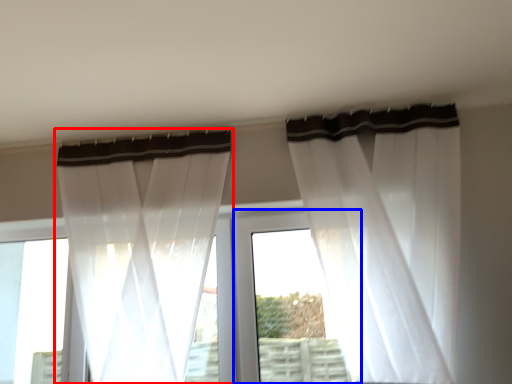
Question: Among these objects, which one is nearest to the camera, curtain (highlighted by a red box) or window frame (highlighted by a blue box)?

Choices:
 (A) curtain
 (B) window frame

Answer: (A)